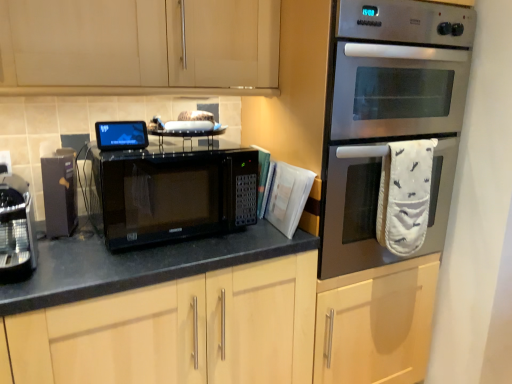
Question: Is sleek metallic coffee machine at left, acting as the 1th appliance starting from the left, taller than stainless steel oven at right?

Choices:
 (A) no
 (B) yes

Answer: (A)

Question: Considering the relative positions of sleek metallic coffee machine at left, acting as the 1th appliance starting from the left, and stainless steel oven at right in the image provided, is sleek metallic coffee machine at left, acting as the 1th appliance starting from the left, behind stainless steel oven at right?

Choices:
 (A) no
 (B) yes

Answer: (A)

Question: From a real-world perspective, is sleek metallic coffee machine at left, the 3th appliance in the right-to-left sequence, beneath stainless steel oven at right?

Choices:
 (A) no
 (B) yes

Answer: (B)

Question: From the image's perspective, is sleek metallic coffee machine at left, acting as the 1th appliance starting from the left, over stainless steel oven at right?

Choices:
 (A) no
 (B) yes

Answer: (A)

Question: From a real-world perspective, is sleek metallic coffee machine at left, the 3th appliance in the right-to-left sequence, on top of stainless steel oven at right?

Choices:
 (A) yes
 (B) no

Answer: (B)

Question: Is sleek metallic coffee machine at left, acting as the 1th appliance starting from the left, positioned before stainless steel oven at right?

Choices:
 (A) no
 (B) yes

Answer: (B)

Question: Is sleek metallic coffee machine at left, the 3th appliance in the right-to-left sequence, wider than matte black microwave at center?

Choices:
 (A) yes
 (B) no

Answer: (B)

Question: From a real-world perspective, is sleek metallic coffee machine at left, acting as the 1th appliance starting from the left, under matte black microwave at center?

Choices:
 (A) no
 (B) yes

Answer: (A)

Question: Is sleek metallic coffee machine at left, acting as the 1th appliance starting from the left, to the right of matte black microwave at center from the viewer's perspective?

Choices:
 (A) no
 (B) yes

Answer: (A)

Question: Can you confirm if sleek metallic coffee machine at left, the 3th appliance in the right-to-left sequence, is bigger than matte black microwave at center?

Choices:
 (A) yes
 (B) no

Answer: (B)

Question: From the image's perspective, does sleek metallic coffee machine at left, acting as the 1th appliance starting from the left, appear lower than matte black microwave at center?

Choices:
 (A) no
 (B) yes

Answer: (A)

Question: Is sleek metallic coffee machine at left, acting as the 1th appliance starting from the left, turned away from matte black microwave at center?

Choices:
 (A) no
 (B) yes

Answer: (A)